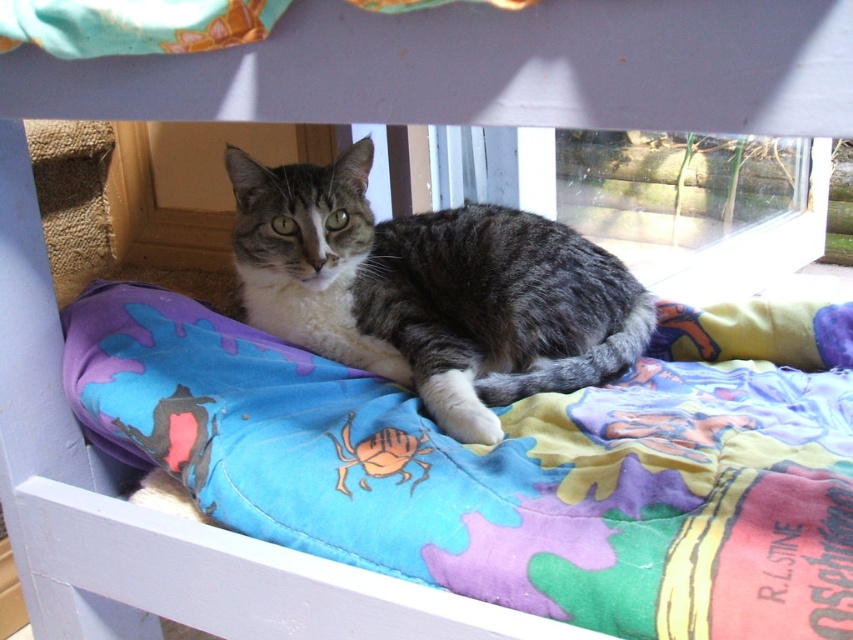
Consider the image. You are a photographer trying to capture the tabby cat on the multicolored quilted blanket at center. The camera has a focus point at coordinates point (x=514, y=465). Will this focus point land on the cat?

The point (x=514, y=465) corresponds to the multicolored quilted blanket at center, so the focus point will land on the quilted blanket, not the cat.

You are taking a photo of the tabby cat and notice two points marked on the quilt. The first point is at coordinates point [590,420] and the second is at point [234,179]. Which point is closer to the camera?

Point [590,420] is closer to the camera than point [234,179].